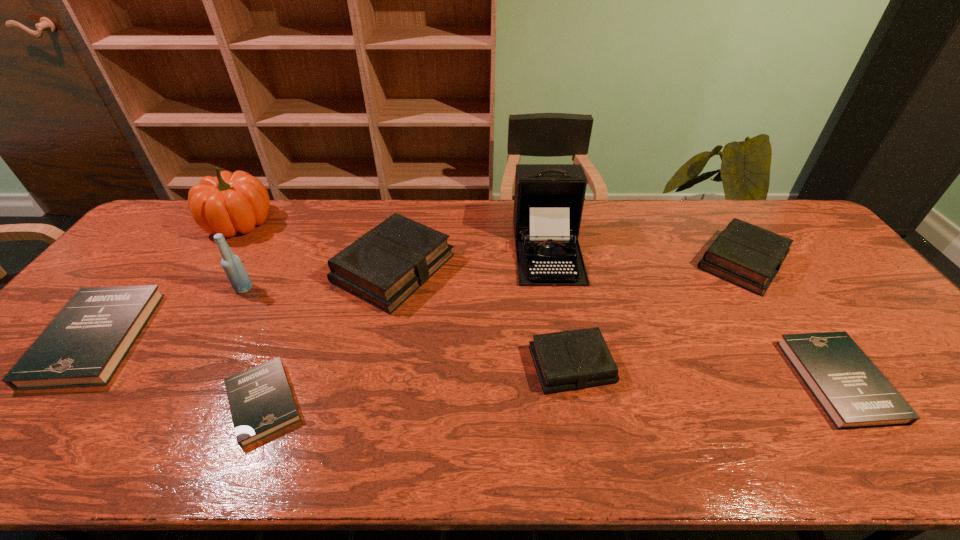
Locate an element on the screen. This screenshot has width=960, height=540. vacant area that lies between the second biggest dark book and the orange pumpkin is located at coordinates (539, 302).

Find the location of a particular element. The width and height of the screenshot is (960, 540). free point between the second dark book from right to left and the pumpkin is located at coordinates tap(252, 313).

Identify the location of free space between the smallest dark book and the typewriter. The image size is (960, 540). (406, 326).

Locate an element on the screen. The width and height of the screenshot is (960, 540). object that can be found as the closest to the nearest greenish book is located at coordinates (548, 202).

Identify the location of object that is the second nearest to the second tallest book. (548, 202).

Where is `the second closest book to the second biggest dark book`? the second closest book to the second biggest dark book is located at coordinates (574, 359).

Select which book is the third closest to the bottle. Please provide its 2D coordinates. Your answer should be formatted as a tuple, i.e. [(x, y)], where the tuple contains the x and y coordinates of a point satisfying the conditions above.

[(261, 402)]

Identify the location of the closest greenish book to the bottle. (384, 267).

Where is `greenish book that is the closest to the eighth tallest object`? The image size is (960, 540). greenish book that is the closest to the eighth tallest object is located at coordinates (746, 255).

Locate which dark book ranks second in proximity to the third shortest book. Please provide its 2D coordinates. Your answer should be formatted as a tuple, i.e. [(x, y)], where the tuple contains the x and y coordinates of a point satisfying the conditions above.

[(853, 392)]